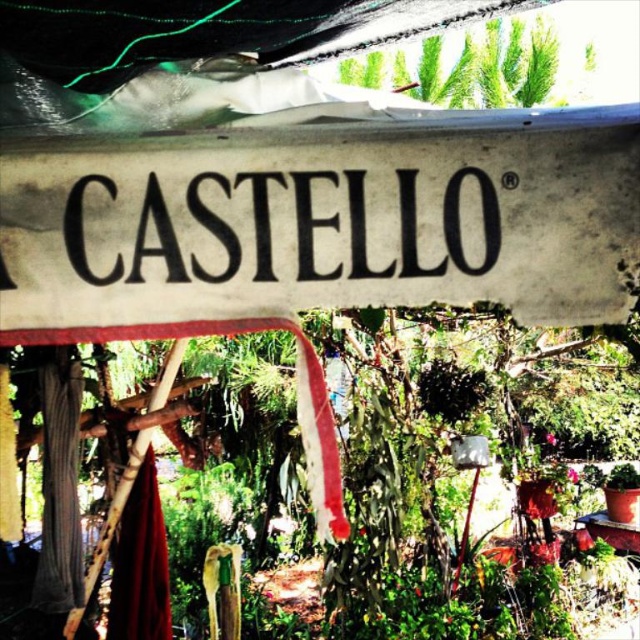
You are standing in front of the white paper sign at center and the green leafy plant at upper center. Which object is closer to you?

The white paper sign at center is closer to you because it is in front of the green leafy plant at upper center.

You are standing in front of the scene described. Where exactly is the black paper sign at center located in terms of coordinates?

The black paper sign at center is located at point coordinates of (x=284, y=227).